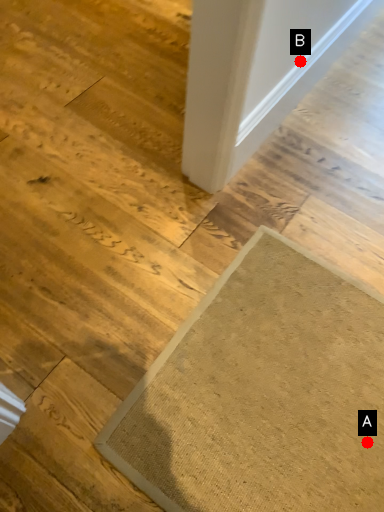
Question: Two points are circled on the image, labeled by A and B beside each circle. Which point is farther from the camera taking this photo?

Choices:
 (A) A is further
 (B) B is further

Answer: (B)